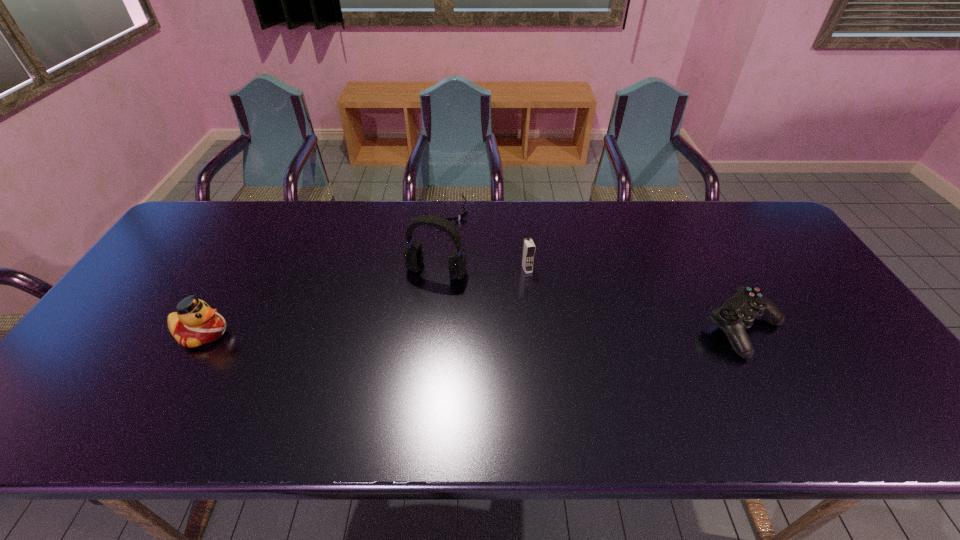
I want to click on duck, so click(195, 323).

Find the location of a particular element. the third shortest object is located at coordinates (195, 323).

Identify the location of the rightmost object. The height and width of the screenshot is (540, 960). (739, 312).

You are a GUI agent. You are given a task and a screenshot of the screen. Output one action in this format:
    pyautogui.click(x=<x>, y=<y>)
    Task: Click on the second shortest object
    The width and height of the screenshot is (960, 540).
    Given the screenshot: What is the action you would take?
    pyautogui.click(x=739, y=312)

Locate an element on the screen. Image resolution: width=960 pixels, height=540 pixels. the farthest object is located at coordinates (459, 217).

What are the coordinates of `the shortest object` in the screenshot? It's located at (459, 217).

The width and height of the screenshot is (960, 540). Identify the location of headset. (413, 254).

At what (x,y) coordinates should I click in order to perform the action: click on the second object from right to left. Please return your answer as a coordinate pair (x, y). Looking at the image, I should click on (528, 252).

Where is `vacant region located on the face of the leftmost object`? vacant region located on the face of the leftmost object is located at coordinates (386, 333).

Image resolution: width=960 pixels, height=540 pixels. In order to click on free space located on the right of the rightmost object in this screenshot , I will do `click(815, 329)`.